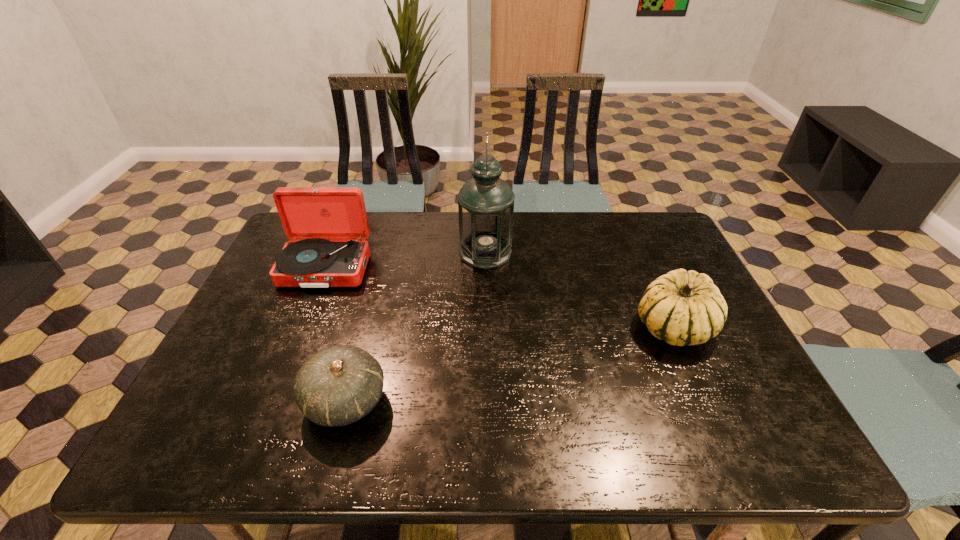
Locate an element on the screen. The height and width of the screenshot is (540, 960). free space at the far right corner of the desktop is located at coordinates (668, 230).

The height and width of the screenshot is (540, 960). I want to click on vacant area that lies between the phonograph_record and the nearest object, so click(335, 335).

Find the location of `blank region between the farther gourd and the phonograph_record`. blank region between the farther gourd and the phonograph_record is located at coordinates (500, 298).

The width and height of the screenshot is (960, 540). Find the location of `unoccupied area between the phonograph_record and the second nearest object`. unoccupied area between the phonograph_record and the second nearest object is located at coordinates (500, 298).

This screenshot has height=540, width=960. In order to click on empty location between the oil lamp and the right gourd in this screenshot , I will do `click(580, 289)`.

The width and height of the screenshot is (960, 540). I want to click on vacant point located between the right gourd and the second tallest object, so click(x=500, y=298).

At what (x,y) coordinates should I click in order to perform the action: click on unoccupied position between the shorter gourd and the third shortest object. Please return your answer as a coordinate pair (x, y). Image resolution: width=960 pixels, height=540 pixels. Looking at the image, I should click on click(335, 335).

Locate an element on the screen. The height and width of the screenshot is (540, 960). free spot between the left gourd and the tallest object is located at coordinates (416, 327).

Locate an element on the screen. free space between the right gourd and the tallest object is located at coordinates (580, 289).

I want to click on vacant area that lies between the oil lamp and the shortest object, so click(416, 327).